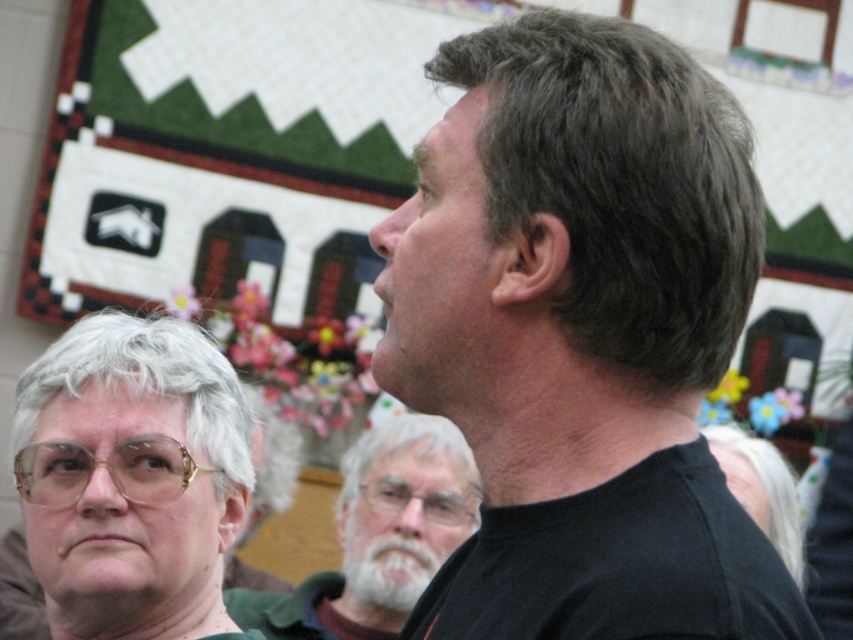
Is gray hair at lower left further to the viewer compared to gray matte hair at center?

Yes, it is behind gray matte hair at center.

Who is more forward, (219,524) or (740,461)?

Point (219,524) is in front.

This screenshot has height=640, width=853. Find the location of `gray hair at lower left`. gray hair at lower left is located at coordinates (148, 387).

Which is behind, point (515, 248) or point (334, 598)?

Point (334, 598)

This screenshot has width=853, height=640. Identify the location of black matte shirt at upper right. (582, 336).

Find the location of a particular element. black matte shirt at upper right is located at coordinates (582, 336).

From the picture: Can you confirm if gray hair at lower left is shorter than white beard at center?

Indeed, gray hair at lower left has a lesser height compared to white beard at center.

Which is more to the right, gray hair at lower left or white beard at center?

white beard at center

Between point (47, 600) and point (439, 524), which one is positioned behind?

Point (439, 524)

The width and height of the screenshot is (853, 640). Find the location of `gray hair at lower left`. gray hair at lower left is located at coordinates (148, 387).